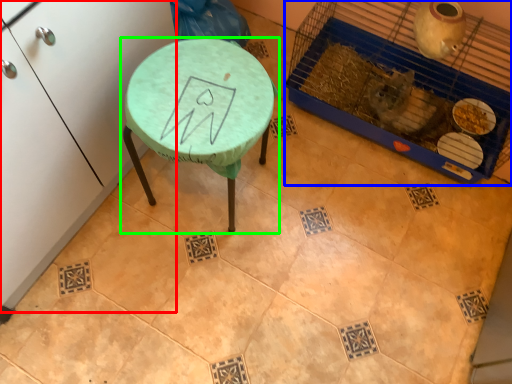
Question: Which object is positioned closest to furniture (highlighted by a red box)? Select from bird cage (highlighted by a blue box) and table (highlighted by a green box).

Choices:
 (A) bird cage
 (B) table

Answer: (B)